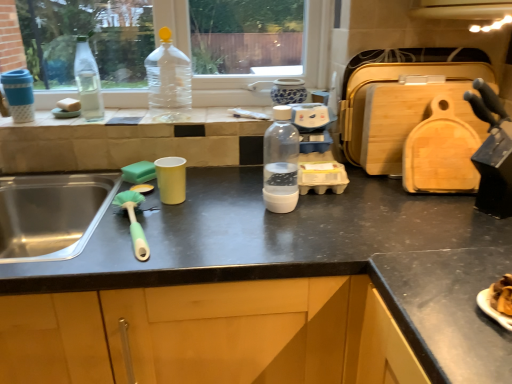
Find the location of `vacant space to the right of green sponge at left, the 1th food from the bottom`. vacant space to the right of green sponge at left, the 1th food from the bottom is located at coordinates (207, 180).